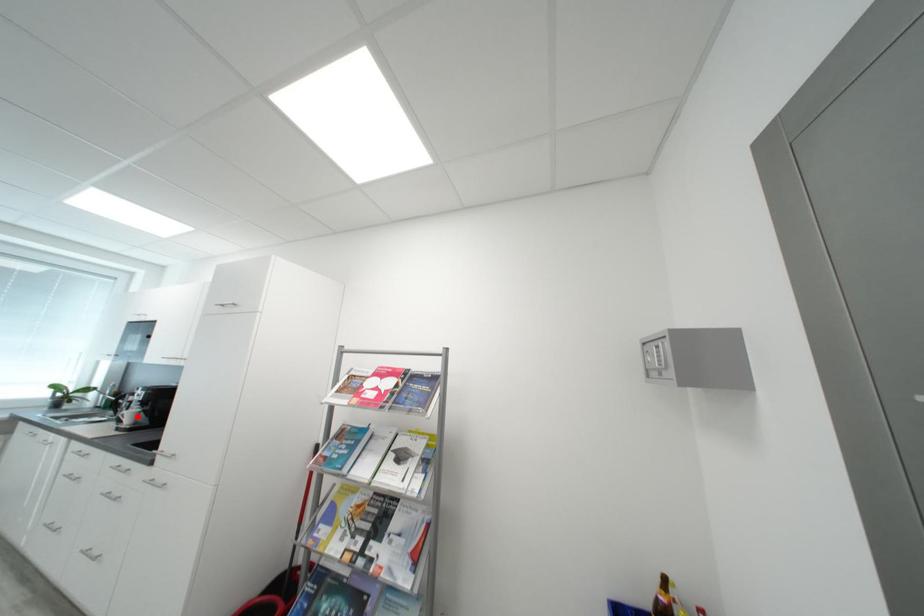
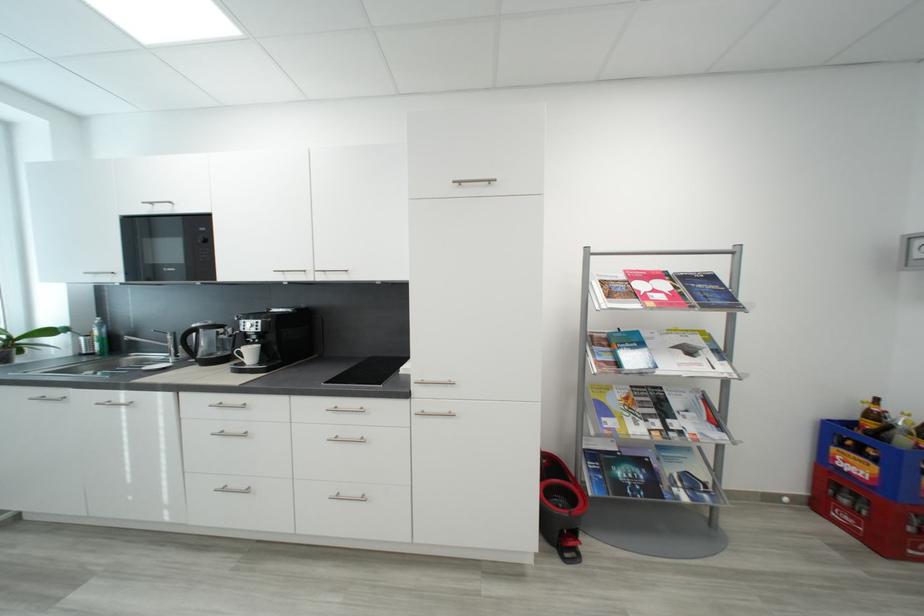
Question: I am providing you with two images of the same scene from different viewpoints. Image1 has a red point marked. In image2, the corresponding 3D location appears at what relative position? Reply with the corresponding letter.

Choices:
 (A) Closer
 (B) Farther

Answer: (B)